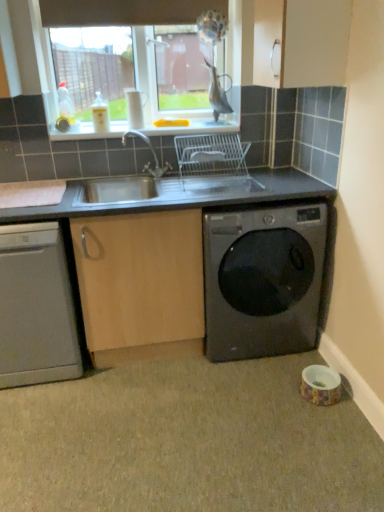
Where is `vacant point above gray matte granite at lower right (from a real-world perspective)`? This screenshot has height=512, width=384. vacant point above gray matte granite at lower right (from a real-world perspective) is located at coordinates (166, 424).